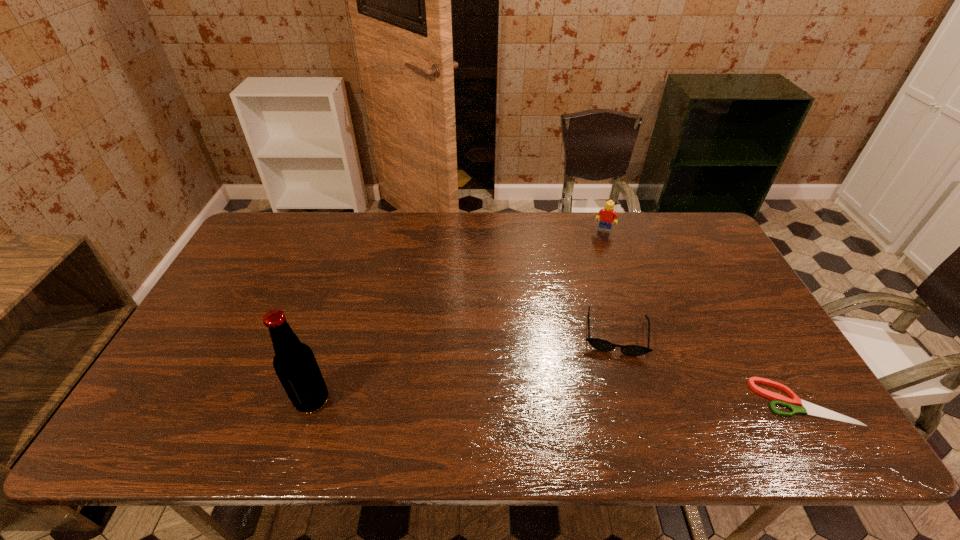
Where is `vacant spot on the desktop that is between the tallest object and the shortest object and is positioned on the front-facing side of the Lego`? This screenshot has width=960, height=540. vacant spot on the desktop that is between the tallest object and the shortest object and is positioned on the front-facing side of the Lego is located at coordinates (547, 401).

You are a GUI agent. You are given a task and a screenshot of the screen. Output one action in this format:
    pyautogui.click(x=<x>, y=<y>)
    Task: Click on the free spot on the desktop that is between the beer bottle and the shortest object and is positioned on the front-facing side of the second shortest object
    The height and width of the screenshot is (540, 960).
    Given the screenshot: What is the action you would take?
    pyautogui.click(x=614, y=401)